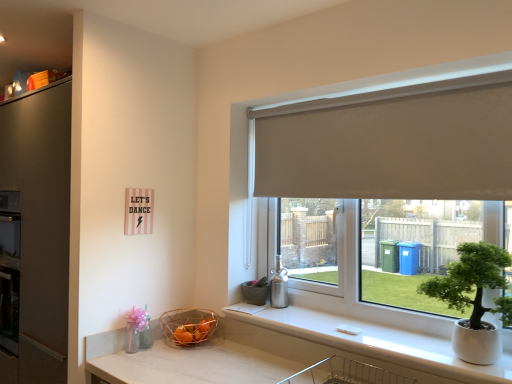
You are a GUI agent. You are given a task and a screenshot of the screen. Output one action in this format:
    pyautogui.click(x=<x>, y=<y>)
    Task: Click on the matte gray flowerpot at window
    The image size is (512, 384).
    Given the screenshot: What is the action you would take?
    pyautogui.click(x=254, y=293)

Measure the distance between white glossy counter top at lower right and camera.

A distance of 1.30 meters exists between white glossy counter top at lower right and camera.

Find the location of a particular element. Image resolution: width=512 pixels, height=384 pixels. white fabric roller blind at upper center is located at coordinates (392, 142).

This screenshot has width=512, height=384. What do you see at coordinates (392, 142) in the screenshot? I see `white fabric roller blind at upper center` at bounding box center [392, 142].

What is the approximate height of green matte houseplant at right?

green matte houseplant at right is 15.34 inches tall.

Where is `matte gray flowerpot at window`? matte gray flowerpot at window is located at coordinates (254, 293).

Is matte gray flowerpot at window not inside copper wire basket at lower center?

That's correct, matte gray flowerpot at window is outside of copper wire basket at lower center.

In the image, there is a matte gray flowerpot at window. Where is `basket below it (from the image's perspective)`? basket below it (from the image's perspective) is located at coordinates (188, 325).

Would you say matte gray flowerpot at window is a long distance from copper wire basket at lower center?

They are positioned close to each other.

Which is behind, matte gray flowerpot at window or copper wire basket at lower center?

matte gray flowerpot at window is further away from the camera.

You are a GUI agent. You are given a task and a screenshot of the screen. Output one action in this format:
    pyautogui.click(x=<x>, y=<y>)
    Task: Click on the counter top on the left of green matte houseplant at right
    This screenshot has width=512, height=384.
    Given the screenshot: What is the action you would take?
    pyautogui.click(x=370, y=339)

Are white glossy counter top at lower right and green matte houseplant at right far apart?

No.

From a real-world perspective, is white glossy counter top at lower right on top of green matte houseplant at right?

No, from a real-world perspective, white glossy counter top at lower right is not on top of green matte houseplant at right.

Looking at this image, is copper wire basket at lower center to the left of green matte houseplant at right from the viewer's perspective?

Indeed, copper wire basket at lower center is positioned on the left side of green matte houseplant at right.

Is copper wire basket at lower center positioned with its back to green matte houseplant at right?

No, copper wire basket at lower center's orientation is not away from green matte houseplant at right.

Locate an element on the screen. This screenshot has height=384, width=512. basket located behind the green matte houseplant at right is located at coordinates (188, 325).

Is copper wire basket at lower center next to green matte houseplant at right and touching it?

copper wire basket at lower center and green matte houseplant at right are not in contact.

From the image's perspective, is green matte houseplant at right located beneath matte gray flowerpot at window?

No.

Considering the sizes of objects green matte houseplant at right and matte gray flowerpot at window in the image provided, who is thinner, green matte houseplant at right or matte gray flowerpot at window?

With smaller width is matte gray flowerpot at window.

Could you tell me if green matte houseplant at right is facing matte gray flowerpot at window?

No, green matte houseplant at right is not turned towards matte gray flowerpot at window.

Relative to white glossy counter top at lower right, is copper wire basket at lower center in front or behind?

copper wire basket at lower center is behind white glossy counter top at lower right.

From a real-world perspective, between copper wire basket at lower center and white glossy counter top at lower right, who is vertically lower?

From a 3D spatial view, copper wire basket at lower center is below.

Is copper wire basket at lower center beside white glossy counter top at lower right?

copper wire basket at lower center and white glossy counter top at lower right are not in contact.

Does matte gray flowerpot at window have a greater width compared to green matte houseplant at right?

No, matte gray flowerpot at window is not wider than green matte houseplant at right.

Is green matte houseplant at right at the back of matte gray flowerpot at window?

That's not correct — matte gray flowerpot at window is not looking away from green matte houseplant at right.

From the image's perspective, is matte gray flowerpot at window positioned above or below green matte houseplant at right?

Clearly, from the image's perspective, matte gray flowerpot at window is below green matte houseplant at right.

Is white fabric roller blind at upper center positioned far away from copper wire basket at lower center?

Yes, white fabric roller blind at upper center is far from copper wire basket at lower center.

Considering the positions of points (502, 186) and (173, 332), is point (502, 186) closer to camera compared to point (173, 332)?

Yes, it is in front of point (173, 332).

The image size is (512, 384). What are the coordinates of `basket located behind the white fabric roller blind at upper center` in the screenshot? It's located at (188, 325).

At what (x,y) coordinates should I click in order to perform the action: click on basket to the left of matte gray flowerpot at window. Please return your answer as a coordinate pair (x, y). The height and width of the screenshot is (384, 512). Looking at the image, I should click on (188, 325).

This screenshot has height=384, width=512. I want to click on houseplant above the white glossy counter top at lower right (from a real-world perspective), so click(x=474, y=299).

Looking at this image, when comparing their distances from copper wire basket at lower center, does matte gray flowerpot at window or white glossy counter top at lower right seem closer?

matte gray flowerpot at window lies closer to copper wire basket at lower center than the other object.

Consider the image. Considering their positions, is copper wire basket at lower center positioned closer to white glossy counter top at lower right than white fabric roller blind at upper center?

The object closer to white glossy counter top at lower right is copper wire basket at lower center.

From the picture: When comparing their distances from white glossy counter top at lower right, does matte gray flowerpot at window or copper wire basket at lower center seem closer?

matte gray flowerpot at window lies closer to white glossy counter top at lower right than the other object.

Considering their positions, is green matte houseplant at right positioned further to matte gray flowerpot at window than white fabric roller blind at upper center?

green matte houseplant at right is further to matte gray flowerpot at window.

From the image, which object appears to be nearer to white fabric roller blind at upper center, white glossy counter top at lower right or green matte houseplant at right?

green matte houseplant at right is closer to white fabric roller blind at upper center.

When comparing their distances from white glossy counter top at lower right, does green matte houseplant at right or white fabric roller blind at upper center seem closer?

The object closer to white glossy counter top at lower right is green matte houseplant at right.

Based on their spatial positions, is copper wire basket at lower center or green matte houseplant at right closer to white glossy counter top at lower right?

green matte houseplant at right is closer to white glossy counter top at lower right.

Which object lies further to the anchor point copper wire basket at lower center, white glossy counter top at lower right or matte gray flowerpot at window?

white glossy counter top at lower right is positioned further to the anchor copper wire basket at lower center.

Where is `houseplant that lies between white fabric roller blind at upper center and white glossy counter top at lower right from top to bottom`? The width and height of the screenshot is (512, 384). houseplant that lies between white fabric roller blind at upper center and white glossy counter top at lower right from top to bottom is located at coordinates (474, 299).

This screenshot has width=512, height=384. I want to click on flowerpot located between copper wire basket at lower center and green matte houseplant at right in the left-right direction, so click(254, 293).

I want to click on counter top between copper wire basket at lower center and green matte houseplant at right in the horizontal direction, so click(370, 339).

Find the location of `window between green matte houseplant at right and matte gray flowerpot at window along the z-axis`. window between green matte houseplant at right and matte gray flowerpot at window along the z-axis is located at coordinates (392, 142).